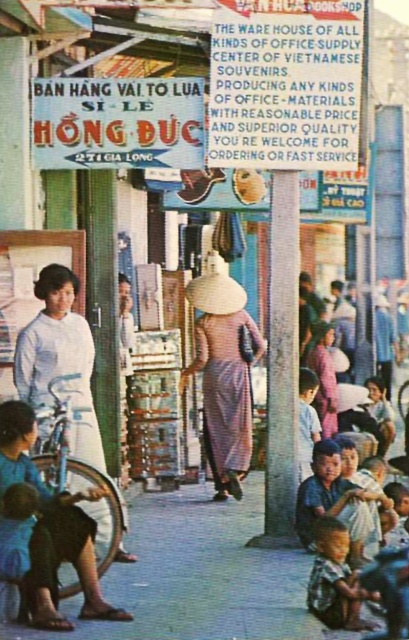
Between matte purple dress at center and light brown skin child at lower right, which one is positioned higher?

matte purple dress at center is higher up.

How much distance is there between matte purple dress at center and light brown skin child at lower right?

matte purple dress at center and light brown skin child at lower right are 4.71 meters apart from each other.

Between point (217, 326) and point (318, 592), which one is positioned in front?

Point (318, 592) is more forward.

You are a GUI agent. You are given a task and a screenshot of the screen. Output one action in this format:
    pyautogui.click(x=<x>, y=<y>)
    Task: Click on the matte purple dress at center
    
    Given the screenshot: What is the action you would take?
    pyautogui.click(x=224, y=376)

Who is lower down, matte purple dress at center or white silk ao dai at center?

Positioned lower is matte purple dress at center.

Does matte purple dress at center lie behind white silk ao dai at center?

Yes.

Image resolution: width=409 pixels, height=640 pixels. Find the location of `matte purple dress at center`. matte purple dress at center is located at coordinates (224, 376).

Between blue cotton shirt at lower left and matte purple dress at center, which one has less height?

Standing shorter between the two is blue cotton shirt at lower left.

Is point (2, 545) positioned behind point (204, 300)?

No, it is not.

At what (x,y) coordinates should I click in order to perform the action: click on blue cotton shirt at lower left. Please return your answer as a coordinate pair (x, y). Looking at the image, I should click on (44, 529).